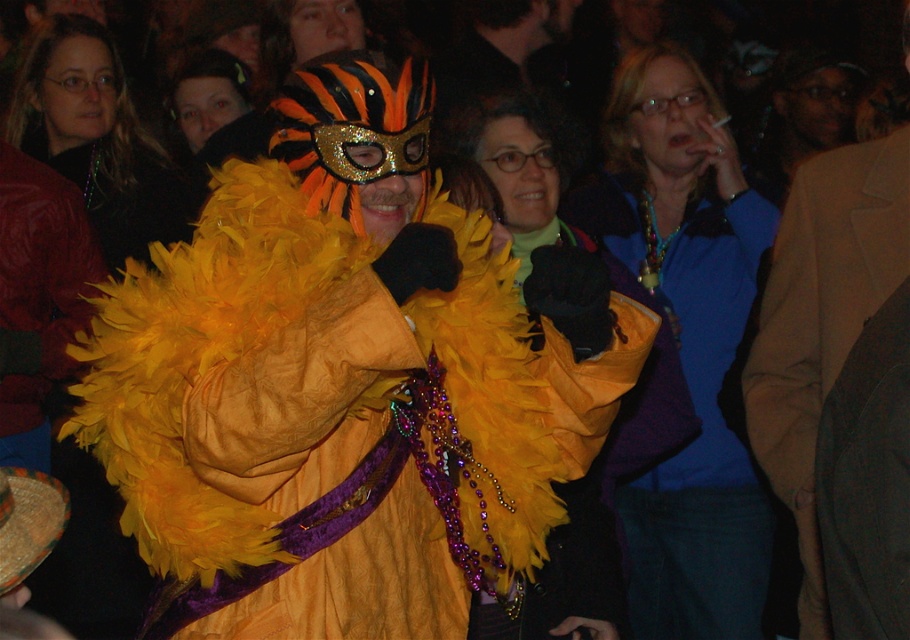
Where is `feathered yellow coat at center`? feathered yellow coat at center is located at coordinates (704, 440).

Who is more forward, (x=730, y=586) or (x=853, y=184)?

Positioned in front is point (x=853, y=184).

I want to click on feathered yellow coat at center, so click(x=704, y=440).